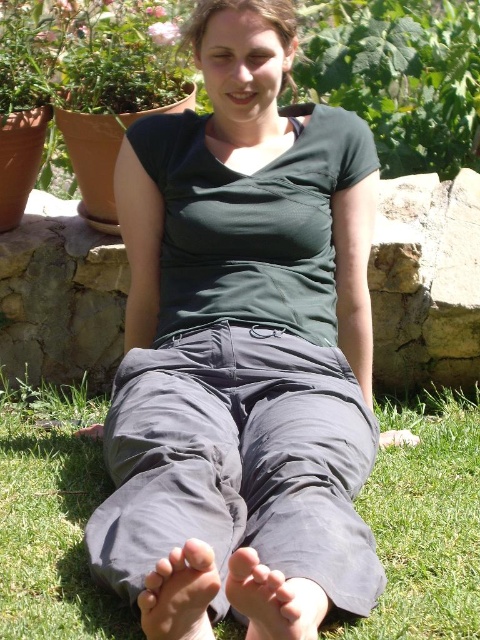
Can you confirm if green leafy plant at upper center is positioned below gray fabric foot at lower center?

No.

Who is positioned more to the left, green leafy plant at upper center or gray fabric foot at lower center?

gray fabric foot at lower center

Between point (343, 100) and point (245, 588), which one is positioned in front?

Point (245, 588)

Image resolution: width=480 pixels, height=640 pixels. I want to click on green leafy plant at upper center, so click(x=399, y=76).

Is green grass at lower center to the left of gray fabric foot at lower center from the viewer's perspective?

No, green grass at lower center is not to the left of gray fabric foot at lower center.

Based on the photo, which of these two, green grass at lower center or gray fabric foot at lower center, stands shorter?

gray fabric foot at lower center is shorter.

Is point (64, 563) closer to camera compared to point (261, 572)?

No, it is not.

This screenshot has width=480, height=640. Find the location of `green grass at lower center`. green grass at lower center is located at coordinates (425, 522).

Is green leafy plant at upper center closer to the viewer compared to smooth gray foot at lower center?

No, it is not.

Can you confirm if green leafy plant at upper center is taller than smooth gray foot at lower center?

Yes, green leafy plant at upper center is taller than smooth gray foot at lower center.

Is point (453, 90) closer to camera compared to point (214, 566)?

No, it is not.

Image resolution: width=480 pixels, height=640 pixels. I want to click on green leafy plant at upper center, so click(399, 76).